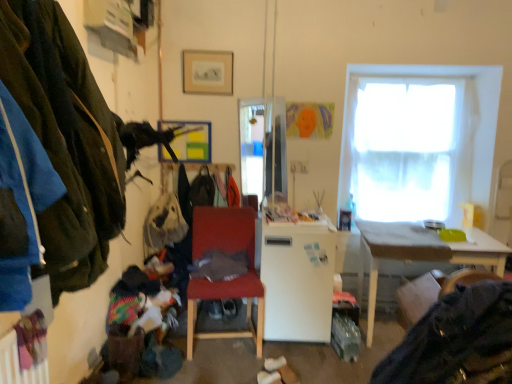
Question: Is metallic silver picture frame at upper center, the first picture frame positioned from the bottom, at the right side of white matte refrigerator at center?

Choices:
 (A) yes
 (B) no

Answer: (B)

Question: Is metallic silver picture frame at upper center, positioned as the second picture frame in front-to-back order, bigger than white matte refrigerator at center?

Choices:
 (A) no
 (B) yes

Answer: (A)

Question: Does metallic silver picture frame at upper center, acting as the first picture frame starting from the back, have a greater width compared to white matte refrigerator at center?

Choices:
 (A) yes
 (B) no

Answer: (B)

Question: Could you tell me if metallic silver picture frame at upper center, the first picture frame positioned from the bottom, is turned towards white matte refrigerator at center?

Choices:
 (A) no
 (B) yes

Answer: (A)

Question: Considering the relative positions of metallic silver picture frame at upper center, the first picture frame positioned from the bottom, and white matte refrigerator at center in the image provided, is metallic silver picture frame at upper center, the first picture frame positioned from the bottom, in front of white matte refrigerator at center?

Choices:
 (A) yes
 (B) no

Answer: (B)

Question: Is dark gray fabric at lower right, arranged as the second clothing when viewed from the left, inside or outside of velvet-like brown swivel chair at lower right?

Choices:
 (A) inside
 (B) outside

Answer: (B)

Question: From the image's perspective, is dark gray fabric at lower right, arranged as the second clothing when viewed from the left, positioned above or below velvet-like brown swivel chair at lower right?

Choices:
 (A) below
 (B) above

Answer: (A)

Question: Is dark gray fabric at lower right, which is the second clothing from top to bottom, taller or shorter than velvet-like brown swivel chair at lower right?

Choices:
 (A) tall
 (B) short

Answer: (A)

Question: From a real-world perspective, relative to velvet-like brown swivel chair at lower right, is dark gray fabric at lower right, which ranks as the first clothing in bottom-to-top order, vertically above or below?

Choices:
 (A) below
 (B) above

Answer: (B)

Question: From a real-world perspective, is matte white desk at right above or below white matte refrigerator at center?

Choices:
 (A) above
 (B) below

Answer: (B)

Question: Would you say matte white desk at right is inside or outside white matte refrigerator at center?

Choices:
 (A) outside
 (B) inside

Answer: (A)

Question: From the image's perspective, is matte white desk at right positioned above or below white matte refrigerator at center?

Choices:
 (A) below
 (B) above

Answer: (A)

Question: Looking at their shapes, would you say matte white desk at right is wider or thinner than white matte refrigerator at center?

Choices:
 (A) thin
 (B) wide

Answer: (B)

Question: From a real-world perspective, is metallic silver picture frame at upper center, the first picture frame positioned from the bottom, above or below velvet-like brown swivel chair at lower right?

Choices:
 (A) below
 (B) above

Answer: (B)

Question: Is point (204, 145) closer or farther from the camera than point (445, 291)?

Choices:
 (A) closer
 (B) farther

Answer: (B)